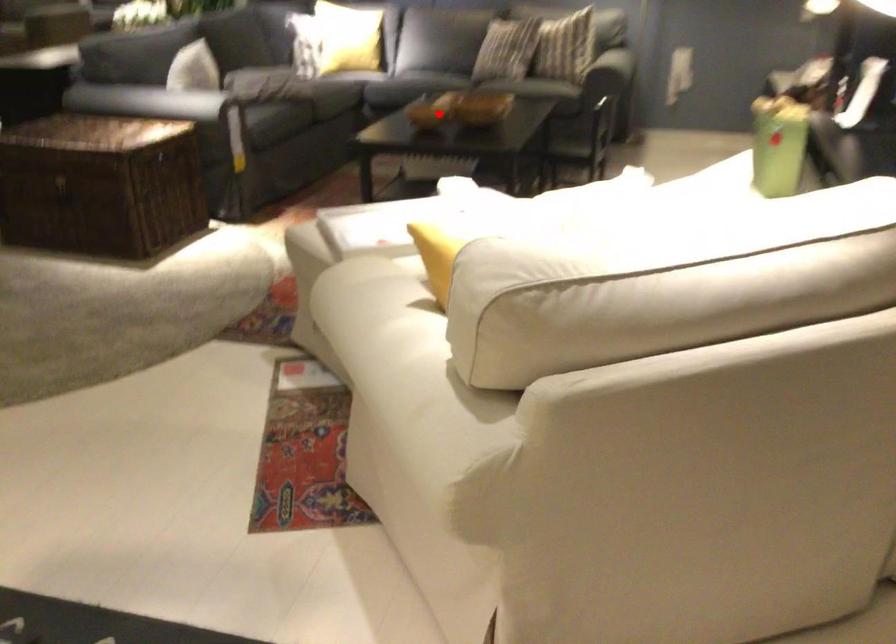
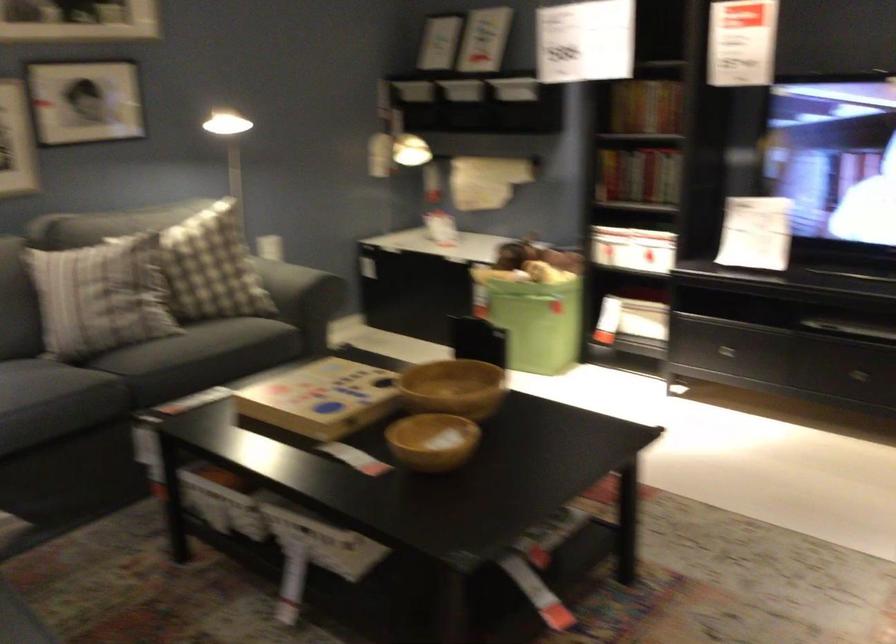
Question: A red point is marked in image1. In image2, is the corresponding 3D point closer to the camera or farther? Reply with the corresponding letter.

Choices:
 (A) The corresponding 3D point is closer.
 (B) The corresponding 3D point is farther.

Answer: (A)